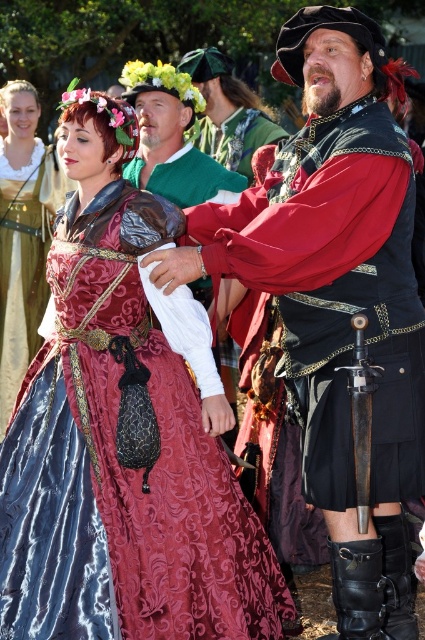
Who is taller, velvet black vest at center or velvet maroon dress at center?

With more height is velvet black vest at center.

Can you confirm if velvet black vest at center is bigger than velvet maroon dress at center?

Yes, velvet black vest at center is bigger than velvet maroon dress at center.

Is point (371, 332) positioned behind point (17, 216)?

No, (371, 332) is closer to viewer.

The height and width of the screenshot is (640, 425). Find the location of `velvet black vest at center`. velvet black vest at center is located at coordinates click(337, 296).

Is velvet black vest at center positioned at the back of matte black kilt at center?

No, it is not.

Can you confirm if velvet black vest at center is positioned to the right of matte black kilt at center?

Yes, velvet black vest at center is to the right of matte black kilt at center.

Where is `velvet black vest at center`? velvet black vest at center is located at coordinates (337, 296).

Identify the location of velvet black vest at center. coord(337,296).

Is point (13, 106) more distant than point (189, 102)?

Yes, it is behind point (189, 102).

Describe the element at coordinates (20, 240) in the screenshot. The height and width of the screenshot is (640, 425). I see `velvet maroon dress at center` at that location.

The width and height of the screenshot is (425, 640). Find the location of `velvet maroon dress at center`. velvet maroon dress at center is located at coordinates (20, 240).